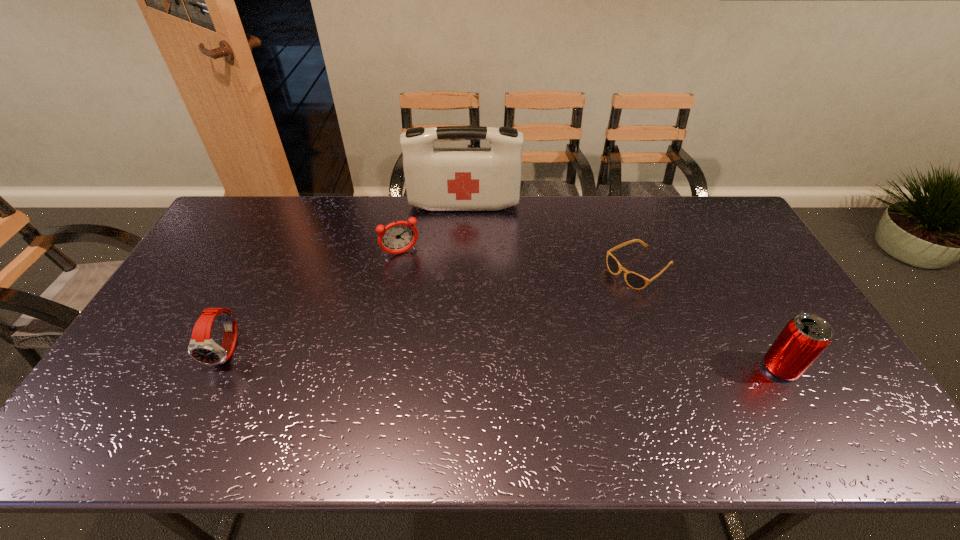
The width and height of the screenshot is (960, 540). What are the coordinates of `free space on the desktop that is between the leftmost object and the fourth shortest object and is positioned on the front-facing side of the shortest object` in the screenshot? It's located at (498, 359).

Locate an element on the screen. This screenshot has width=960, height=540. vacant space on the desktop that is between the leftmost object and the second tallest object and is positioned on the front-facing side of the alarm clock is located at coordinates (446, 357).

Locate an element on the screen. This screenshot has height=540, width=960. vacant spot on the desktop that is between the watch and the fourth shortest object and is positioned on the front side of the farthest object is located at coordinates (459, 357).